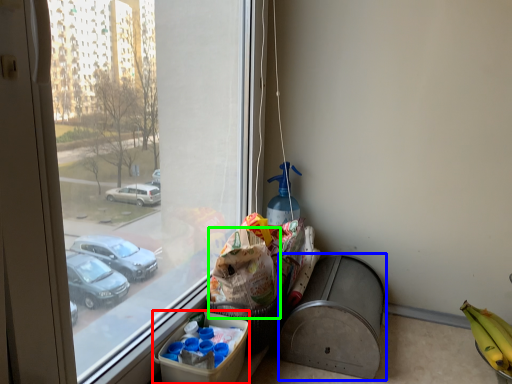
Question: Which object is positioned closest to cardboard box (highlighted by a red box)? Select from recycling bin (highlighted by a blue box) and grocery bag (highlighted by a green box).

Choices:
 (A) recycling bin
 (B) grocery bag

Answer: (B)